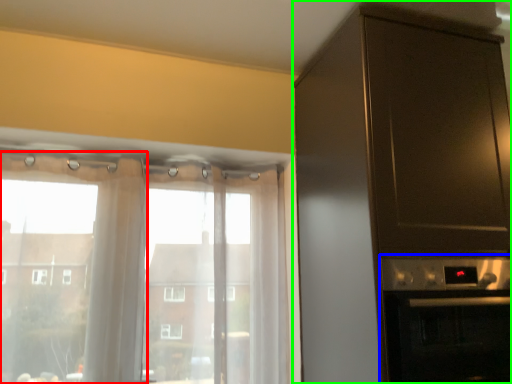
Question: Estimate the real-world distances between objects in this image. Which object is closer to curtain (highlighted by a red box), appliance (highlighted by a blue box) or cabinetry (highlighted by a green box)?

Choices:
 (A) appliance
 (B) cabinetry

Answer: (B)